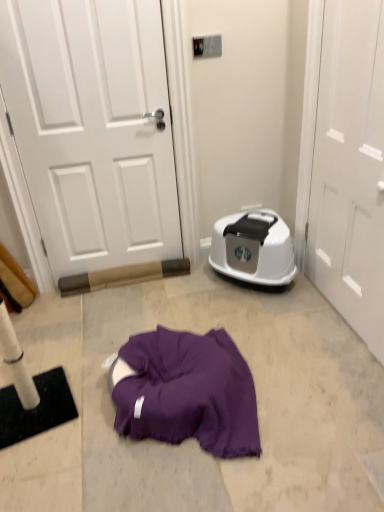
Question: Is white matte door at upper left, which is the 2th door from right to left, located within white glossy door at right, the second door from the left?

Choices:
 (A) yes
 (B) no

Answer: (B)

Question: Is white glossy door at right, the first door in the right-to-left sequence, thinner than white matte door at upper left, which is the 2th door from right to left?

Choices:
 (A) no
 (B) yes

Answer: (B)

Question: Is white glossy door at right, the first door in the right-to-left sequence, in contact with white matte door at upper left, which is the 2th door from right to left?

Choices:
 (A) yes
 (B) no

Answer: (B)

Question: Does white glossy door at right, the first door in the right-to-left sequence, have a lesser height compared to white matte door at upper left, which is counted as the 1th door, starting from the left?

Choices:
 (A) no
 (B) yes

Answer: (B)

Question: Is white glossy door at right, the second door from the left, located outside white matte door at upper left, which is counted as the 1th door, starting from the left?

Choices:
 (A) no
 (B) yes

Answer: (B)

Question: From the image's perspective, is white glossy dishwasher at right positioned above or below white matte door at upper left, which is the 2th door from right to left?

Choices:
 (A) below
 (B) above

Answer: (A)

Question: From a real-world perspective, is white glossy dishwasher at right physically located above or below white matte door at upper left, which is the 2th door from right to left?

Choices:
 (A) above
 (B) below

Answer: (B)

Question: Is white glossy dishwasher at right in front of or behind white matte door at upper left, which is counted as the 1th door, starting from the left, in the image?

Choices:
 (A) behind
 (B) front

Answer: (A)

Question: Is white glossy dishwasher at right situated inside white matte door at upper left, which is counted as the 1th door, starting from the left, or outside?

Choices:
 (A) inside
 (B) outside

Answer: (B)

Question: Is point (349, 122) closer or farther from the camera than point (266, 246)?

Choices:
 (A) closer
 (B) farther

Answer: (A)

Question: Is white glossy door at right, the second door from the left, taller or shorter than white glossy dishwasher at right?

Choices:
 (A) tall
 (B) short

Answer: (A)

Question: From a real-world perspective, relative to white glossy dishwasher at right, is white glossy door at right, the first door in the right-to-left sequence, vertically above or below?

Choices:
 (A) below
 (B) above

Answer: (B)

Question: Is white glossy door at right, the first door in the right-to-left sequence, in front of or behind white glossy dishwasher at right in the image?

Choices:
 (A) behind
 (B) front

Answer: (B)

Question: Is white glossy dishwasher at right in front of or behind white glossy door at right, the first door in the right-to-left sequence, in the image?

Choices:
 (A) front
 (B) behind

Answer: (B)

Question: Is point (256, 226) positioned closer to the camera than point (344, 199)?

Choices:
 (A) closer
 (B) farther

Answer: (B)